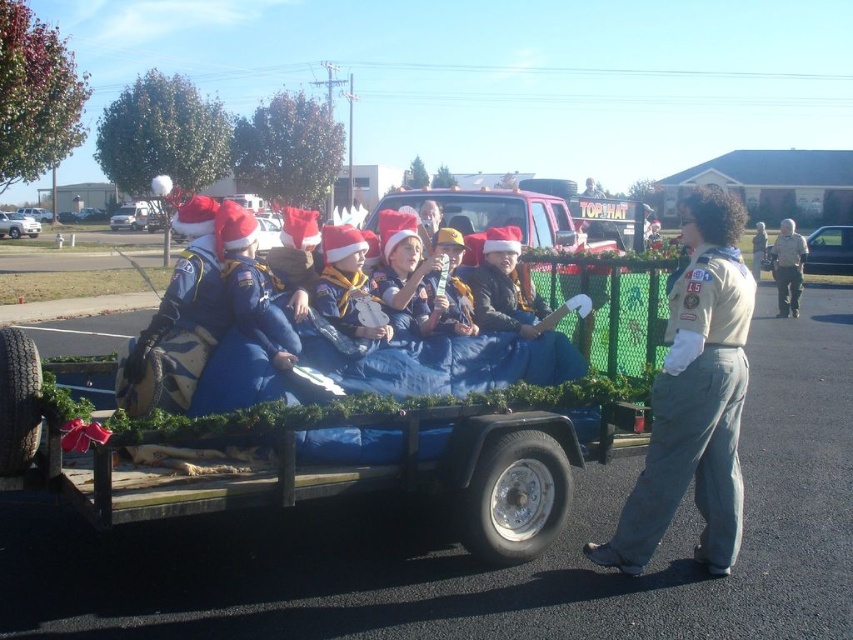
Does tan uniform at center appear on the right side of gray uniform at right?

Incorrect, tan uniform at center is not on the right side of gray uniform at right.

Can you confirm if tan uniform at center is positioned below gray uniform at right?

Indeed, tan uniform at center is positioned under gray uniform at right.

The width and height of the screenshot is (853, 640). What are the coordinates of `tan uniform at center` in the screenshot? It's located at (694, 397).